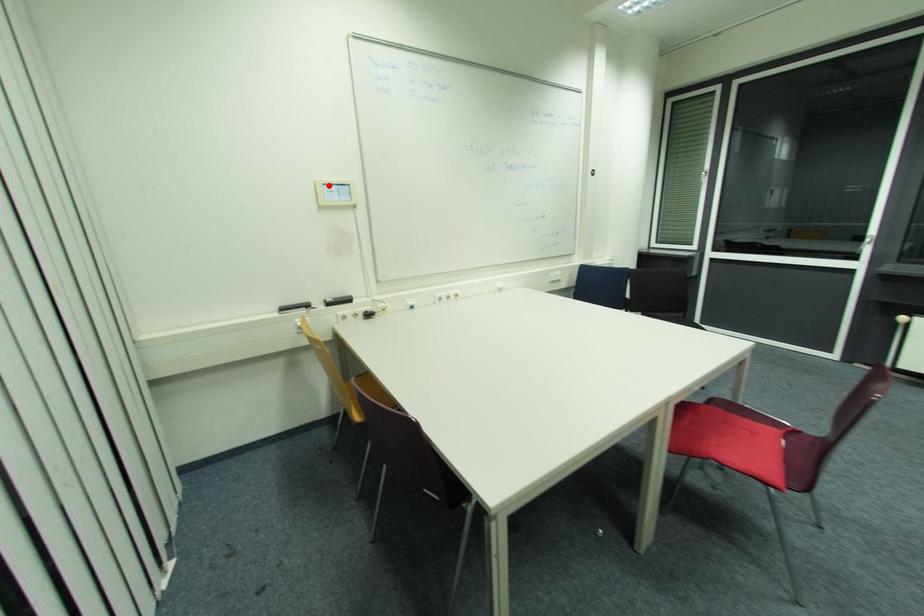
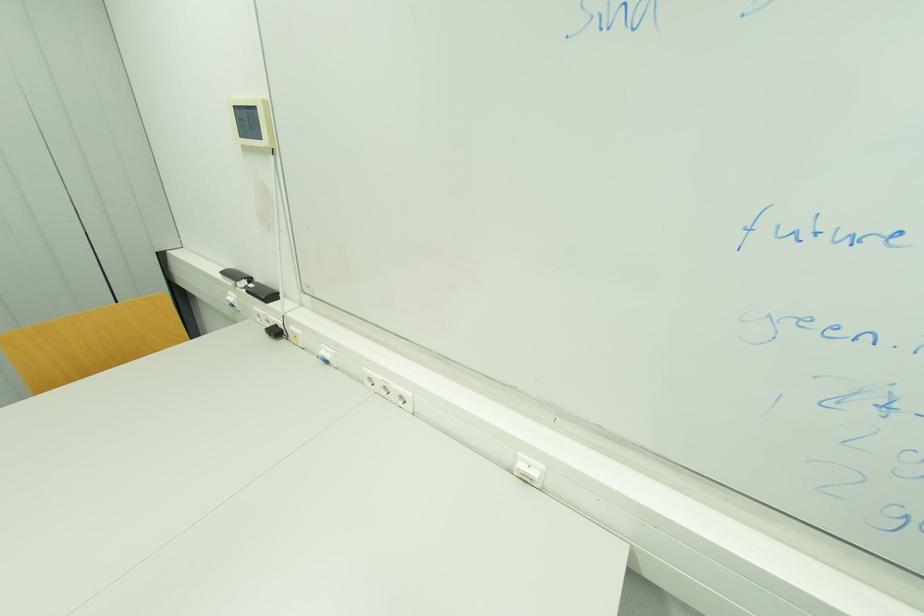
Where in the second image is the point corresponding to the highlighted location from the first image?

(237, 108)